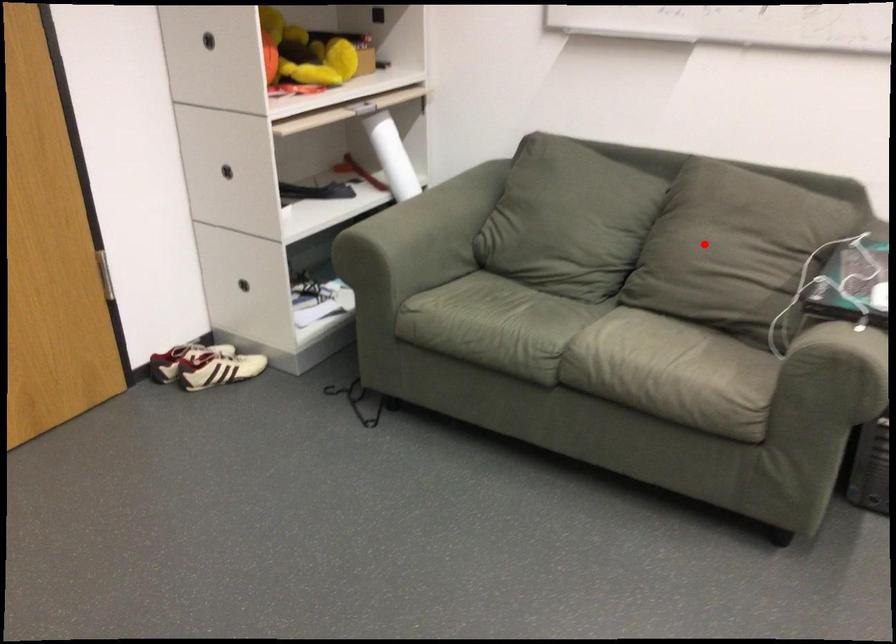
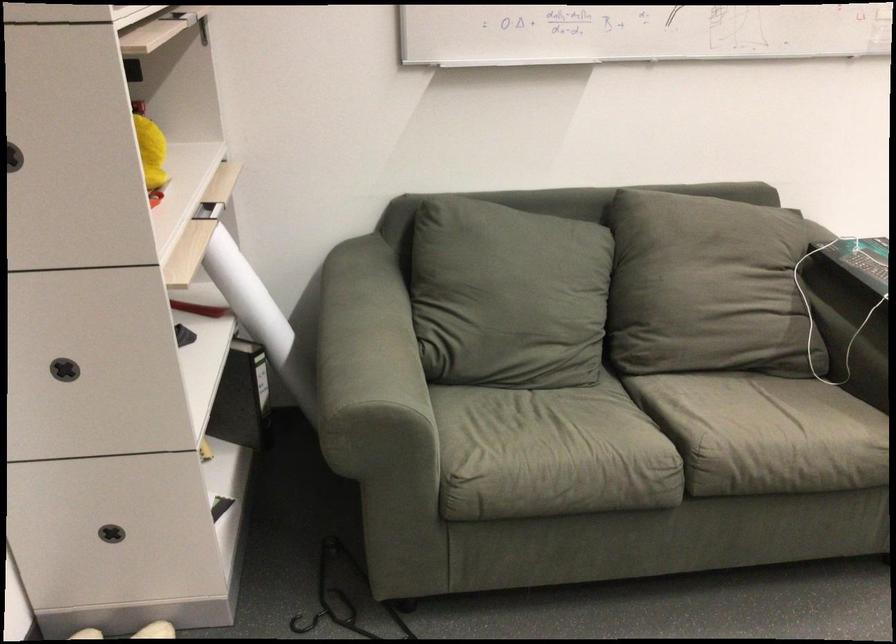
The point at the highlighted location is marked in the first image. Where is the corresponding point in the second image?

(707, 287)